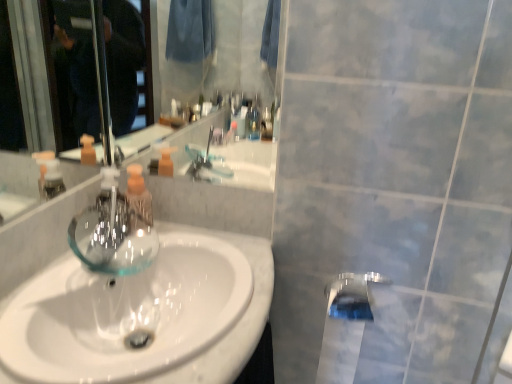
Identify the location of free space in front of clear glass bottle at center. Image resolution: width=512 pixels, height=384 pixels. (106, 262).